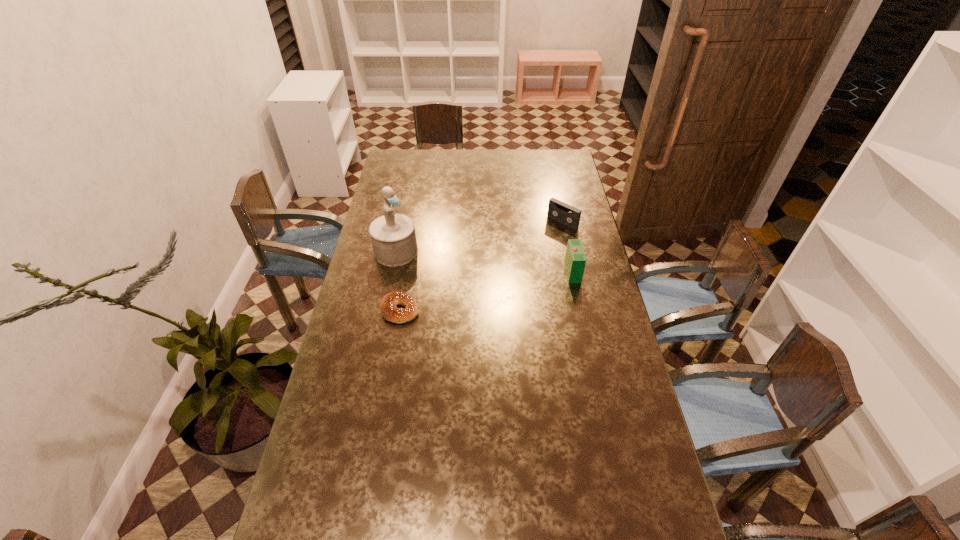
Find the location of a particular element. The width and height of the screenshot is (960, 540). free space between the figurine and the third tallest object is located at coordinates (479, 237).

The width and height of the screenshot is (960, 540). Identify the location of blank region between the nearest object and the third shortest object. (487, 291).

Where is `vacant space in between the bagel and the third shortest object`? vacant space in between the bagel and the third shortest object is located at coordinates (487, 291).

Find the location of `object that can be found as the second closest to the tallest object`. object that can be found as the second closest to the tallest object is located at coordinates (568, 215).

Identify the location of object that is the third nearest to the figurine. This screenshot has width=960, height=540. (575, 260).

I want to click on free space that satisfies the following two spatial constraints: 1. on the back side of the videotape; 2. on the right side of the bagel, so click(x=415, y=222).

In order to click on free space that satisfies the following two spatial constraints: 1. on the front side of the nearest object; 2. on the left side of the tallest object in this screenshot , I will do `click(384, 309)`.

Image resolution: width=960 pixels, height=540 pixels. Identify the location of vacant region that satisfies the following two spatial constraints: 1. on the back side of the second tallest object; 2. on the front-facing side of the shortest object. (x=406, y=272).

The height and width of the screenshot is (540, 960). I want to click on vacant space that satisfies the following two spatial constraints: 1. on the back side of the tallest object; 2. on the right side of the farthest object, so click(x=402, y=222).